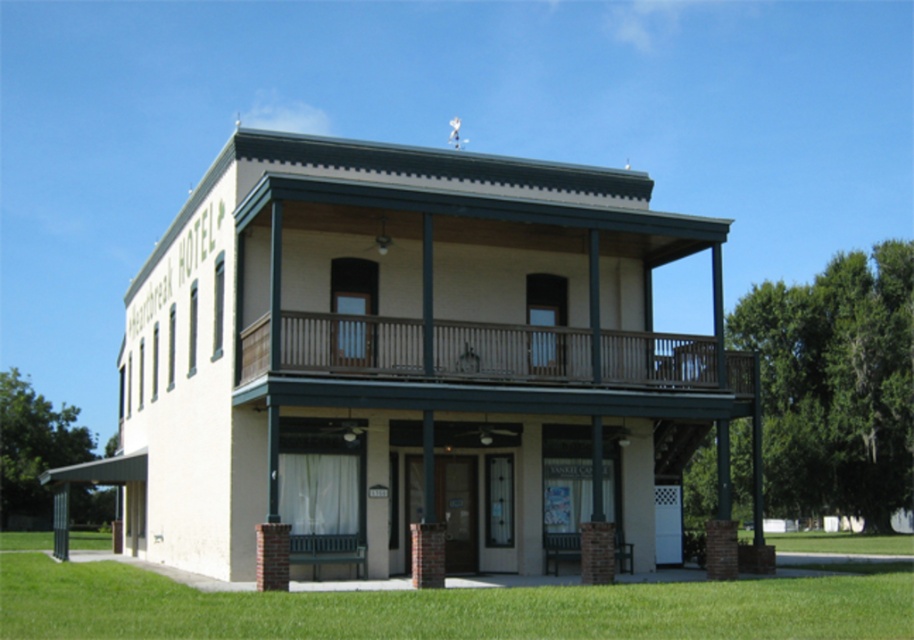
You are standing in front of the Heartbreak Hotel and want to walk from point (426, 625) to point (238, 397). Which direction should you move relative to the building?

Since point (426, 625) is closer to the viewer than point (238, 397), you should move away from the building towards the latter point.

Based on the photo, you are a delivery person carrying a package that requires a clear path of at least 15 feet to reach the front door of the Heartbreak Hotel. You are currently standing on the green grass at lower center. Can you safely move towards the brown wooden porch at upper center without needing to detour around any obstacles?

The distance between the green grass at lower center and the brown wooden porch at upper center is 17.87 feet, which is more than the required 15 feet. Therefore, you can safely move towards the brown wooden porch at upper center without needing to detour around any obstacles.